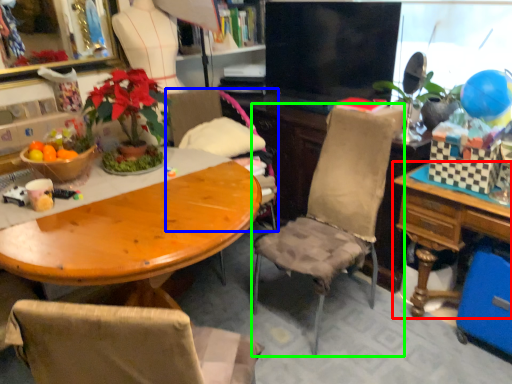
Question: Which object is positioned closest to table (highlighted by a red box)? Select from chair (highlighted by a blue box) and chair (highlighted by a green box).

Choices:
 (A) chair
 (B) chair

Answer: (B)